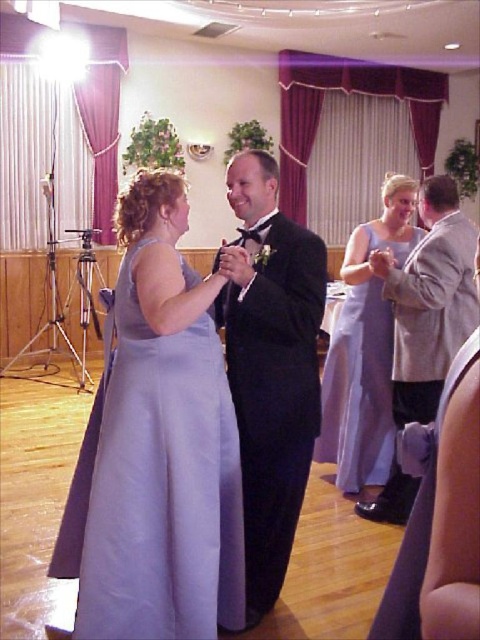
Can you confirm if black satin tuxedo at center is shorter than gray wool suit at right?

Incorrect, black satin tuxedo at center's height does not fall short of gray wool suit at right's.

The height and width of the screenshot is (640, 480). What are the coordinates of `black satin tuxedo at center` in the screenshot? It's located at (269, 365).

Is point (213, 538) behind point (295, 323)?

No, it is not.

Which is more to the right, lavender satin dress at center or black satin tuxedo at center?

Positioned to the right is black satin tuxedo at center.

Where is `lavender satin dress at center`? lavender satin dress at center is located at coordinates (162, 484).

Is lavender satin dress at right above gray wool suit at right?

No, lavender satin dress at right is not above gray wool suit at right.

Does point (407, 193) come behind point (465, 337)?

Yes.

Does point (384, 460) lie in front of point (376, 252)?

No, it is behind (376, 252).

I want to click on lavender satin dress at right, so click(x=364, y=348).